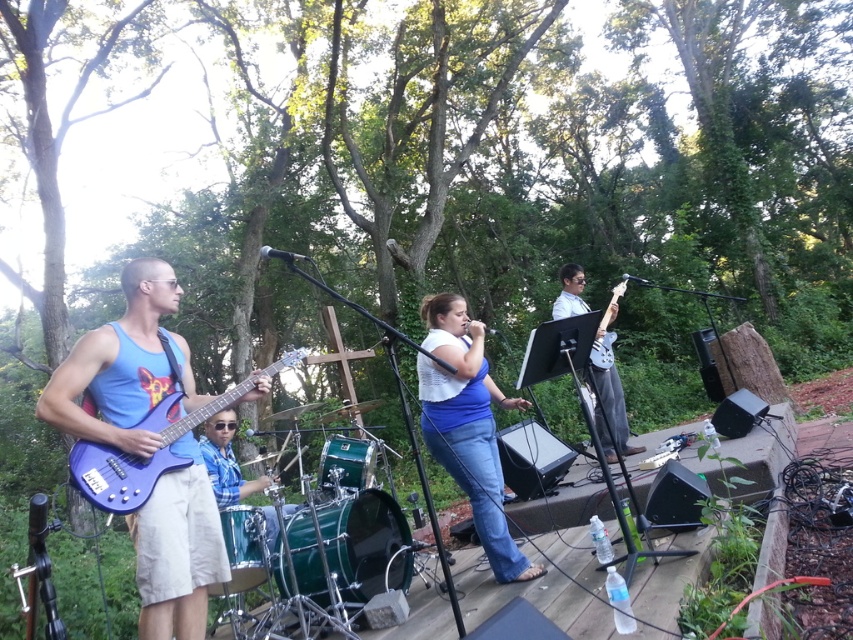
You are a stagehand preparing to adjust the microphone stands for the performers. You notice two guitars on the left side of the stage. Which one is positioned lower, the matte blue guitar at left or the matte blue electric guitar at left?

The matte blue guitar at left is positioned lower than the matte blue electric guitar at left according to the description.

You are a photographer trying to capture a clear shot of both the blue denim jeans at center and the matte black guitar at center from the audience area. Which object will appear larger in your photo?

The blue denim jeans at center will appear larger in the photo because it is much taller than the matte black guitar at center.